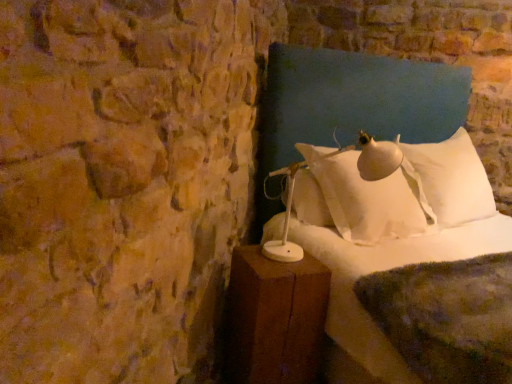
Question: From a real-world perspective, is white soft bed at center on top of white soft pillow at upper right?

Choices:
 (A) no
 (B) yes

Answer: (B)

Question: From the image's perspective, is white soft bed at center over white soft pillow at upper right?

Choices:
 (A) no
 (B) yes

Answer: (A)

Question: Considering the relative positions of white soft bed at center and white soft pillow at upper right in the image provided, is white soft bed at center behind white soft pillow at upper right?

Choices:
 (A) no
 (B) yes

Answer: (A)

Question: Can you confirm if white soft bed at center is smaller than white soft pillow at upper right?

Choices:
 (A) yes
 (B) no

Answer: (B)

Question: Is white soft bed at center positioned in front of white soft pillow at upper right?

Choices:
 (A) no
 (B) yes

Answer: (B)

Question: Visually, is white soft pillow at upper right positioned to the left or to the right of brown wooden nightstand at lower right?

Choices:
 (A) left
 (B) right

Answer: (B)

Question: Does point (412, 205) appear closer or farther from the camera than point (287, 372)?

Choices:
 (A) closer
 (B) farther

Answer: (B)

Question: From a real-world perspective, is white soft pillow at upper right positioned above or below brown wooden nightstand at lower right?

Choices:
 (A) above
 (B) below

Answer: (A)

Question: Is white soft pillow at upper right inside the boundaries of brown wooden nightstand at lower right, or outside?

Choices:
 (A) inside
 (B) outside

Answer: (B)

Question: From the image's perspective, is white soft pillow at upper right above or below white soft bed at center?

Choices:
 (A) above
 (B) below

Answer: (A)

Question: Is white soft pillow at upper right in front of or behind white soft bed at center in the image?

Choices:
 (A) behind
 (B) front

Answer: (A)

Question: In terms of height, does white soft pillow at upper right look taller or shorter compared to white soft bed at center?

Choices:
 (A) tall
 (B) short

Answer: (B)

Question: In the image, is white soft pillow at upper right on the left side or the right side of white soft bed at center?

Choices:
 (A) left
 (B) right

Answer: (A)

Question: In terms of width, does brown wooden nightstand at lower right look wider or thinner when compared to white soft pillow at upper right?

Choices:
 (A) wide
 (B) thin

Answer: (B)

Question: Considering the positions of brown wooden nightstand at lower right and white soft pillow at upper right in the image, is brown wooden nightstand at lower right taller or shorter than white soft pillow at upper right?

Choices:
 (A) tall
 (B) short

Answer: (B)